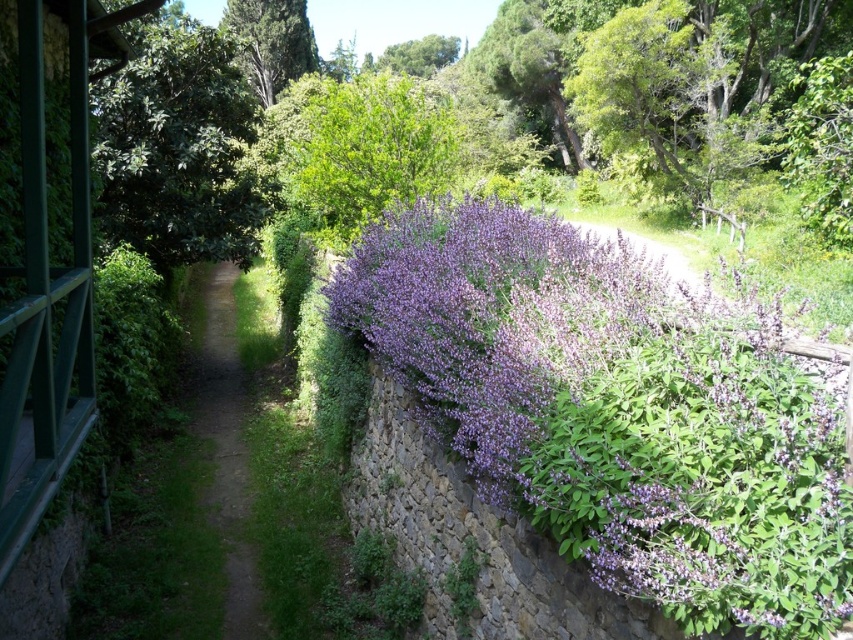
Question: Can you confirm if purple leafy bush at center is wider than green textured tree at upper center?

Choices:
 (A) yes
 (B) no

Answer: (B)

Question: Among these points, which one is nearest to the camera?

Choices:
 (A) (131, 108)
 (B) (308, 36)

Answer: (A)

Question: Can you confirm if green leafy tree at upper left is positioned to the right of green textured tree at upper center?

Choices:
 (A) no
 (B) yes

Answer: (B)

Question: Which of the following is the farthest from the observer?

Choices:
 (A) green textured tree at upper center
 (B) dirt path at center
 (C) green leafy tree at upper left
 (D) purple leafy bush at center

Answer: (A)

Question: Which of the following is the farthest from the observer?

Choices:
 (A) (103, 132)
 (B) (224, 518)
 (C) (498, 268)

Answer: (A)

Question: Is purple leafy bush at center below green leafy tree at upper left?

Choices:
 (A) yes
 (B) no

Answer: (A)